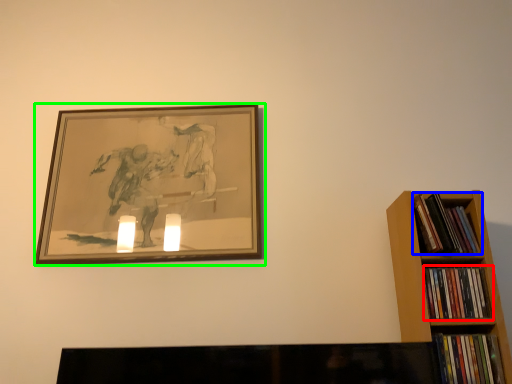
Question: Estimate the real-world distances between objects in this image. Which object is closer to book (highlighted by a red box), book (highlighted by a blue box) or picture frame (highlighted by a green box)?

Choices:
 (A) book
 (B) picture frame

Answer: (A)